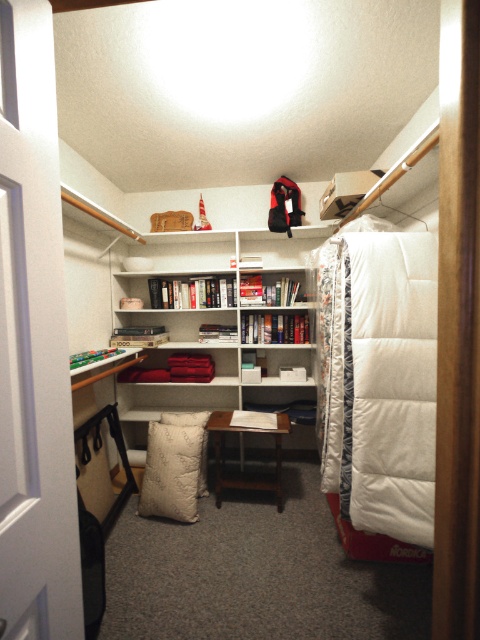
From the picture: Is white matte bookcase at center wider than white down pillow at center?

Indeed, white matte bookcase at center has a greater width compared to white down pillow at center.

This screenshot has width=480, height=640. What do you see at coordinates (223, 323) in the screenshot? I see `white matte bookcase at center` at bounding box center [223, 323].

The image size is (480, 640). Find the location of `white matte bookcase at center`. white matte bookcase at center is located at coordinates (223, 323).

Does white matte bookcase at center have a smaller size compared to brown wooden table at center?

No, white matte bookcase at center is not smaller than brown wooden table at center.

Which is behind, point (264, 348) or point (226, 480)?

Point (264, 348)

The height and width of the screenshot is (640, 480). Describe the element at coordinates (223, 323) in the screenshot. I see `white matte bookcase at center` at that location.

The image size is (480, 640). In order to click on white matte bookcase at center in this screenshot , I will do `click(223, 323)`.

Is point (216, 442) closer to camera compared to point (199, 420)?

That is True.

Which is in front, point (219, 440) or point (204, 458)?

Positioned in front is point (204, 458).

Identify the location of brown wooden table at center. (243, 456).